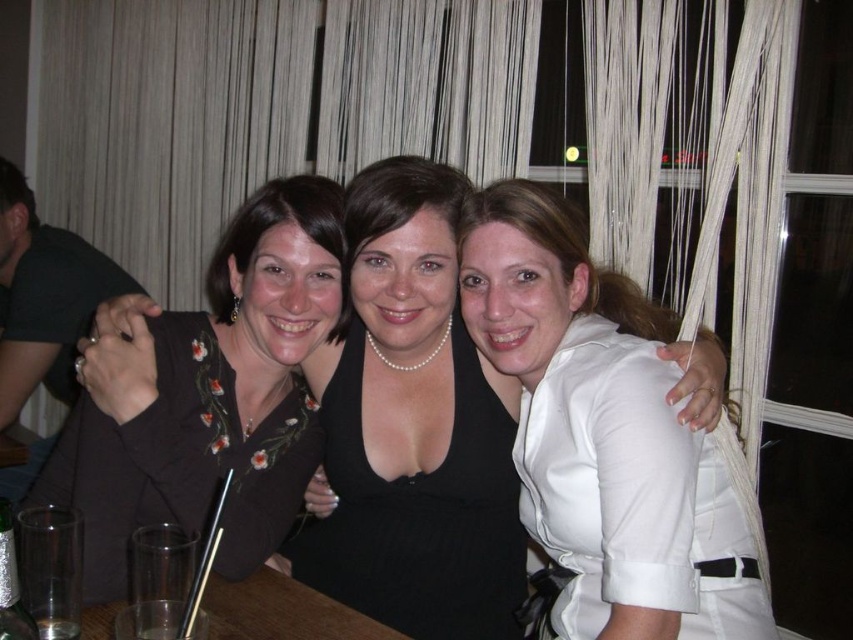
Between silver metallic ring at left and clear glass at lower left, which one is positioned higher?

Positioned higher is silver metallic ring at left.

Locate an element on the screen. Image resolution: width=853 pixels, height=640 pixels. silver metallic ring at left is located at coordinates (44, 298).

Where is `silver metallic ring at left`? This screenshot has height=640, width=853. silver metallic ring at left is located at coordinates (44, 298).

This screenshot has height=640, width=853. In order to click on silver metallic ring at left in this screenshot , I will do coord(44,298).

From the picture: Is white satin blouse at upper right further to camera compared to clear glass table at center?

No.

Can you confirm if white satin blouse at upper right is positioned below clear glass table at center?

Incorrect, white satin blouse at upper right is not positioned below clear glass table at center.

Where is `white satin blouse at upper right`? This screenshot has height=640, width=853. white satin blouse at upper right is located at coordinates (602, 435).

Is white satin blouse at upper right positioned behind silver metallic ring at left?

No, it is in front of silver metallic ring at left.

Does white satin blouse at upper right lie in front of silver metallic ring at left?

Yes, white satin blouse at upper right is closer to the viewer.

Where is `white satin blouse at upper right`? The image size is (853, 640). white satin blouse at upper right is located at coordinates (602, 435).

Where is `white satin blouse at upper right`? white satin blouse at upper right is located at coordinates (602, 435).